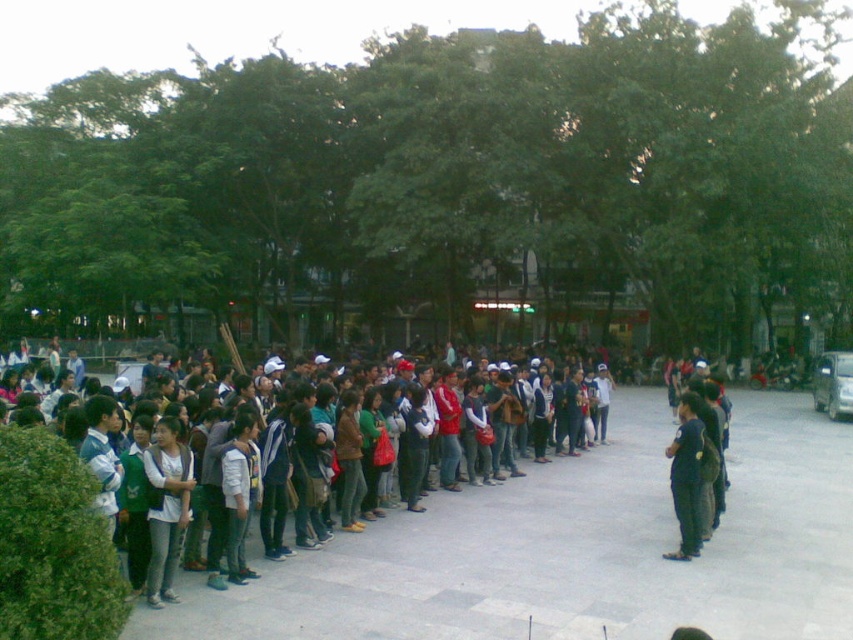
You are a photographer trying to capture a wide shot of the crowd in the V formation. You notice the green leafy tree at center and the light gray jeans at lower left in your frame. Which object takes up more horizontal space in the photo?

The green leafy tree at center takes up more horizontal space in the photo because its width is larger than that of the light gray jeans at lower left.

You are standing at the center of the gathering and notice a person wearing light gray jeans at lower left. Based on their position, can you determine if they are closer to you or further away compared to the rest of the crowd?

The light gray jeans at lower left is located at point (166, 506), which places them closer to the viewer than the rest of the crowd in the distance.